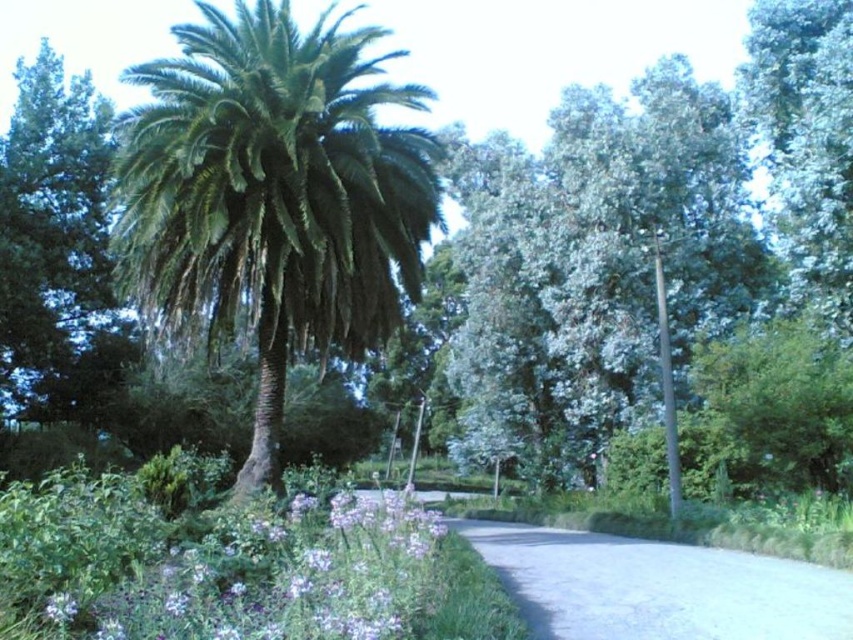
You are a gardener who needs to water the green leafy palm at center and the gray concrete driveway at center. Since the driveway doesn

The green leafy palm at center is to the left of the gray concrete driveway at center, so you should water the green leafy palm at center first before moving to the driveway.